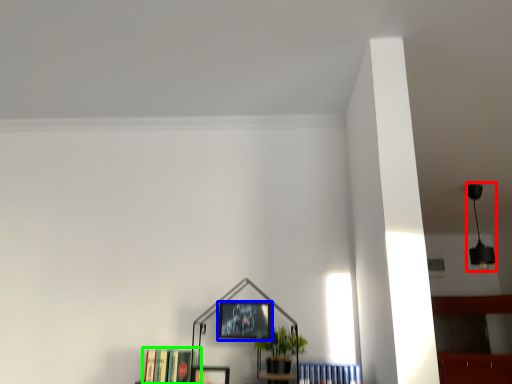
Question: Estimate the real-world distances between objects in this image. Which object is farther from lamp (highlighted by a red box), picture frame (highlighted by a blue box) or book (highlighted by a green box)?

Choices:
 (A) picture frame
 (B) book

Answer: (B)